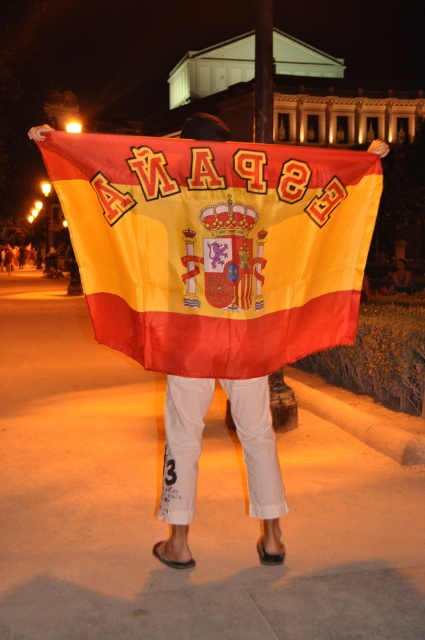
Question: Can you confirm if textured cotton flag at center is smaller than brown wooden pole at upper center?

Choices:
 (A) no
 (B) yes

Answer: (A)

Question: Which point appears closest to the camera in this image?

Choices:
 (A) (261, 42)
 (B) (124, 243)

Answer: (B)

Question: Is textured cotton flag at center positioned behind brown wooden pole at upper center?

Choices:
 (A) yes
 (B) no

Answer: (B)

Question: Is textured cotton flag at center closer to camera compared to brown wooden pole at upper center?

Choices:
 (A) no
 (B) yes

Answer: (B)